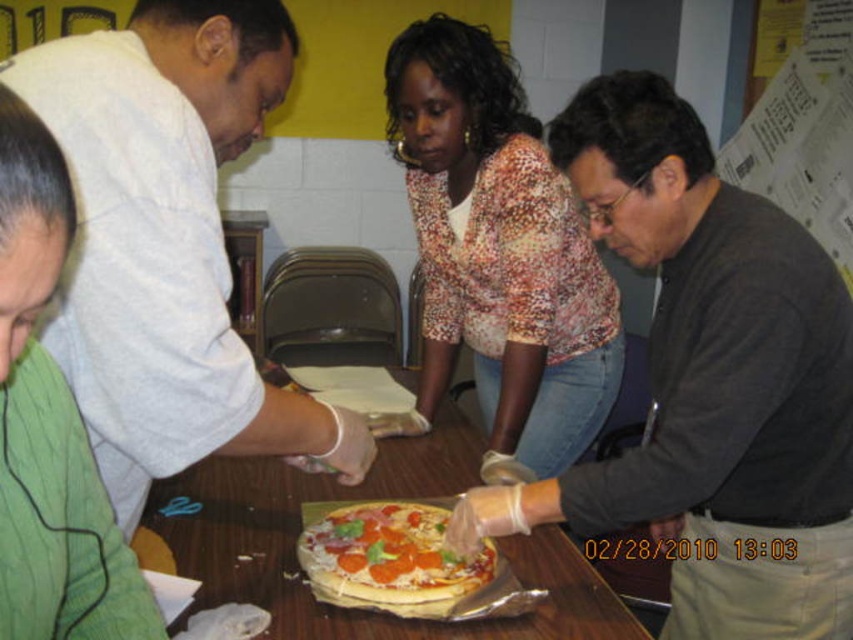
Question: Which object appears farthest from the camera in this image?

Choices:
 (A) cheesy pepperoni pizza at center
 (B) white paper at upper right

Answer: (B)

Question: Which point is farther to the camera?

Choices:
 (A) matte black shirt at center
 (B) wooden table at center

Answer: (B)

Question: Does green textured shirt at lower left appear over cheesy pepperoni pizza at center?

Choices:
 (A) yes
 (B) no

Answer: (A)

Question: Does printed fabric blouse at center have a larger size compared to cheesy pepperoni pizza at center?

Choices:
 (A) yes
 (B) no

Answer: (A)

Question: From the image, what is the correct spatial relationship of matte black shirt at center in relation to white paper at upper right?

Choices:
 (A) left
 (B) right

Answer: (A)

Question: Which of the following is the farthest from the observer?

Choices:
 (A) white matte shirt at upper left
 (B) printed fabric blouse at center

Answer: (B)